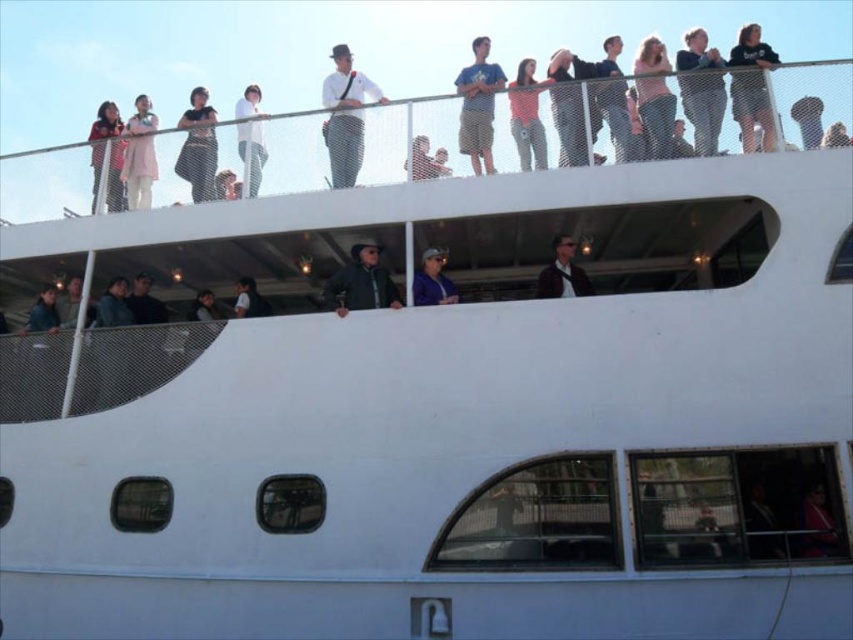
You are a photographer on the boat and want to take a photo of the white textured pants at upper center and dark gray jacket at center. Which object should you focus on first if you want to capture both in the frame without adjusting your camera angle?

The white textured pants at upper center is not as tall as dark gray jacket at center, so you should focus on the dark gray jacket at center first to ensure both are in the frame.

You are a photographer on the boat trying to capture a candid shot of the black textured pants at upper left and the white cotton shirt at upper center. Your camera has a minimum focus distance of 12 inches. Can you take a clear photo of both subjects without moving your position?

The distance between the black textured pants at upper left and the white cotton shirt at upper center is 15.24 inches. Since the camera requires a minimum focus distance of 12 inches, you can take a clear photo of both subjects without moving your position.

You are a photographer on the boat and want to take a photo of the black textured pants at upper left and the white cotton shirt at upper center. Which one should you focus on first if you want to capture both in the same frame without moving the camera?

The black textured pants at upper left is taller than the white cotton shirt at upper center, so you should focus on the black textured pants at upper left first to ensure both are in the frame.